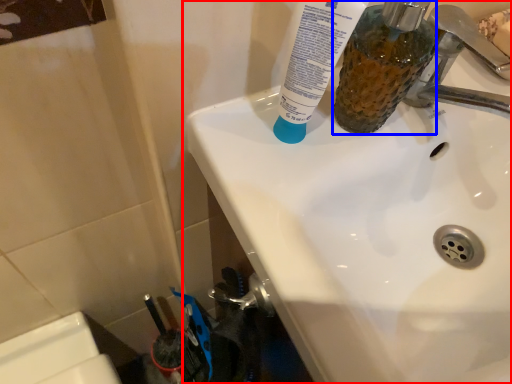
Question: Which object is closer to the camera taking this photo, sink (highlighted by a red box) or mouthwash (highlighted by a blue box)?

Choices:
 (A) sink
 (B) mouthwash

Answer: (A)